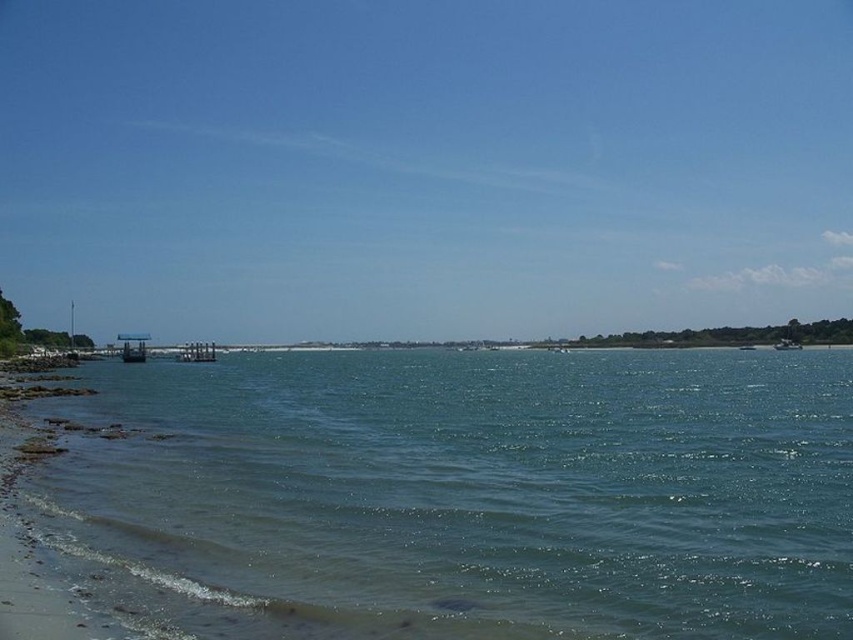
You are a marine biologist planning to place a research buoy between the metallic gray dock at center and the metallic silver boat at right. To ensure it stays in place, you need to know which object is wider. Can you determine which one is wider?

The metallic gray dock at center is wider than the metallic silver boat at right, so the buoy should be placed closer to the boat to stay within the narrower area.

You are planning to take a photo of the clear blue water at lower left and the metallic gray dock at center. Since you want both subjects to be clearly visible in the frame, which one should you prioritize positioning closer to the center of the photo?

You should prioritize positioning the metallic gray dock at center closer to the center of the photo because the clear blue water at lower left is wider than the metallic gray dock at center, so it will occupy more space in the frame even if placed slightly off center.